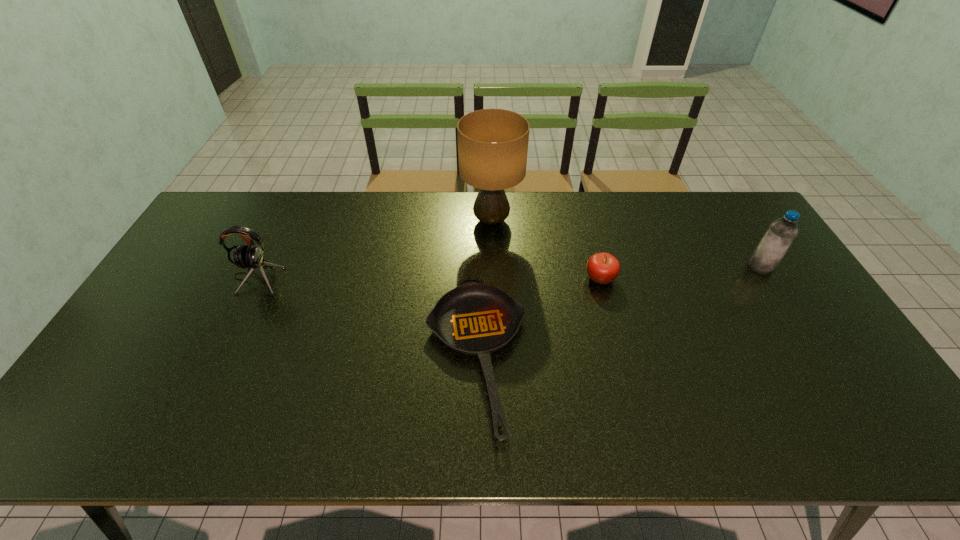
I want to click on unoccupied position between the apple and the water bottle, so click(x=681, y=272).

What are the coordinates of `vacant point located between the earphone and the rightmost object` in the screenshot? It's located at click(509, 272).

You are a GUI agent. You are given a task and a screenshot of the screen. Output one action in this format:
    pyautogui.click(x=<x>, y=<y>)
    Task: Click on the vacant region between the earphone and the water bottle
    The height and width of the screenshot is (540, 960).
    Given the screenshot: What is the action you would take?
    pyautogui.click(x=509, y=272)

Find the location of `vacant region between the frying pan and the leftmost object`. vacant region between the frying pan and the leftmost object is located at coordinates (367, 316).

You are a GUI agent. You are given a task and a screenshot of the screen. Output one action in this format:
    pyautogui.click(x=<x>, y=<y>)
    Task: Click on the free spot between the water bottle and the earphone
    Image resolution: width=960 pixels, height=540 pixels.
    Given the screenshot: What is the action you would take?
    pyautogui.click(x=509, y=272)

Find the location of `free space between the tallest object and the apple`. free space between the tallest object and the apple is located at coordinates pyautogui.click(x=545, y=249).

Locate an element on the screen. empty space that is in between the earphone and the second object from right to left is located at coordinates [429, 278].

Locate an element on the screen. Image resolution: width=960 pixels, height=540 pixels. vacant space in between the shortest object and the fourth object from left to right is located at coordinates (539, 316).

Locate an element on the screen. Image resolution: width=960 pixels, height=540 pixels. free space between the apple and the rightmost object is located at coordinates (681, 272).

Select which object appears as the fourth closest to the earphone. Please provide its 2D coordinates. Your answer should be formatted as a tuple, i.e. [(x, y)], where the tuple contains the x and y coordinates of a point satisfying the conditions above.

[(781, 233)]